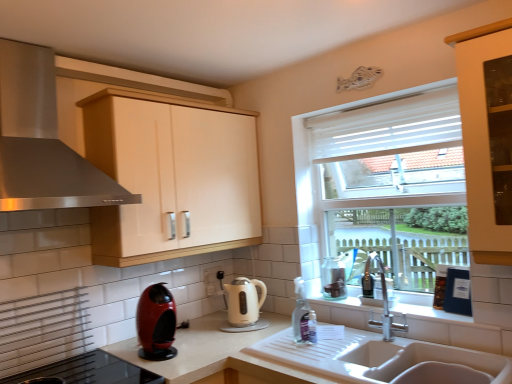
What do you see at coordinates (170, 176) in the screenshot? I see `matte cream cabinet at upper center` at bounding box center [170, 176].

Describe the element at coordinates (156, 323) in the screenshot. Image resolution: width=512 pixels, height=384 pixels. I see `shiny red coffee machine at lower left, which is counted as the second kitchen appliance, starting from the right` at that location.

The width and height of the screenshot is (512, 384). Describe the element at coordinates (385, 360) in the screenshot. I see `white ceramic sink at lower center` at that location.

Measure the distance between point (350, 334) and camera.

1.98 meters.

What do you see at coordinates (221, 356) in the screenshot? The height and width of the screenshot is (384, 512). I see `white matte countertop at sink` at bounding box center [221, 356].

The height and width of the screenshot is (384, 512). In order to click on matte cream cabinet at upper center in this screenshot , I will do `click(170, 176)`.

Is white matte countertop at sink positioned in front of clear glass jar at right?

Yes, white matte countertop at sink is in front of clear glass jar at right.

Considering the positions of objects white matte countertop at sink and clear glass jar at right in the image provided, who is more to the left, white matte countertop at sink or clear glass jar at right?

From the viewer's perspective, white matte countertop at sink appears more on the left side.

Which point is more forward, (123, 372) or (331, 261)?

The point (123, 372) is more forward.

Is white matte countertop at sink aimed at clear glass jar at right?

No, white matte countertop at sink is not facing towards clear glass jar at right.

Considering the sizes of matte cream cabinet at upper center and shiny red coffee machine at lower left, which ranks as the 2th kitchen appliance in back-to-front order, in the image, is matte cream cabinet at upper center taller or shorter than shiny red coffee machine at lower left, which ranks as the 2th kitchen appliance in back-to-front order,?

Clearly, matte cream cabinet at upper center is taller compared to shiny red coffee machine at lower left, which ranks as the 2th kitchen appliance in back-to-front order.

Is shiny red coffee machine at lower left, positioned as the 1th kitchen appliance in left-to-right order, a part of matte cream cabinet at upper center?

Actually, shiny red coffee machine at lower left, positioned as the 1th kitchen appliance in left-to-right order, is outside matte cream cabinet at upper center.

Which object is positioned more to the left, matte cream cabinet at upper center or shiny red coffee machine at lower left, which is counted as the second kitchen appliance, starting from the right?

Positioned to the left is shiny red coffee machine at lower left, which is counted as the second kitchen appliance, starting from the right.

Which is behind, point (196, 252) or point (146, 304)?

The point (196, 252) is more distant.

Does stainless steel range hood at upper left have a greater width compared to white matte countertop at sink?

Incorrect, the width of stainless steel range hood at upper left does not surpass that of white matte countertop at sink.

Does stainless steel range hood at upper left have a greater height compared to white matte countertop at sink?

Yes.

Find the location of a particular element. The height and width of the screenshot is (384, 512). home appliance to the left of white matte countertop at sink is located at coordinates (42, 141).

Which of these two, stainless steel range hood at upper left or white matte countertop at sink, is bigger?

white matte countertop at sink.

Considering the relative sizes of white matte countertop at sink and white ceramic sink at lower center in the image provided, is white matte countertop at sink smaller than white ceramic sink at lower center?

No, white matte countertop at sink is not smaller than white ceramic sink at lower center.

Based on the photo, is white matte countertop at sink surrounding white ceramic sink at lower center?

Indeed, white ceramic sink at lower center is located within white matte countertop at sink.

Is white matte countertop at sink closer to camera compared to white ceramic sink at lower center?

Yes, white matte countertop at sink is in front of white ceramic sink at lower center.

Who is bigger, shiny red coffee machine at lower left, arranged as the 1th kitchen appliance when viewed from the front, or white ceramic sink at lower center?

With larger size is white ceramic sink at lower center.

Is shiny red coffee machine at lower left, arranged as the 1th kitchen appliance when viewed from the front, wider or thinner than white ceramic sink at lower center?

shiny red coffee machine at lower left, arranged as the 1th kitchen appliance when viewed from the front, is thinner than white ceramic sink at lower center.

Is shiny red coffee machine at lower left, which is counted as the second kitchen appliance, starting from the right, completely or partially outside of white ceramic sink at lower center?

Yes, shiny red coffee machine at lower left, which is counted as the second kitchen appliance, starting from the right, is not within white ceramic sink at lower center.

From the image's perspective, between shiny red coffee machine at lower left, which is counted as the second kitchen appliance, starting from the right, and white ceramic sink at lower center, which one is located above?

shiny red coffee machine at lower left, which is counted as the second kitchen appliance, starting from the right, is shown above in the image.

From a real-world perspective, which object rests below the other?

In real-world perspective, white matte countertop at sink is lower.

Is matte cream cabinet at upper center located within white matte countertop at sink?

Definitely not — matte cream cabinet at upper center is not inside white matte countertop at sink.

Find the location of a particular element. countertop below the matte cream cabinet at upper center (from the image's perspective) is located at coordinates (221, 356).

Who is taller, white matte countertop at sink or matte cream cabinet at upper center?

Standing taller between the two is matte cream cabinet at upper center.

From a real-world perspective, is clear glass jar at right under stainless steel range hood at upper left?

Indeed, from a real-world perspective, clear glass jar at right is positioned beneath stainless steel range hood at upper left.

From the image's perspective, is clear glass jar at right located beneath stainless steel range hood at upper left?

Correct, clear glass jar at right appears lower than stainless steel range hood at upper left in the image.

Who is smaller, clear glass jar at right or stainless steel range hood at upper left?

clear glass jar at right is smaller.

Identify the location of countertop to the left of clear glass jar at right. (221, 356).

The width and height of the screenshot is (512, 384). I want to click on cabinetry behind the shiny red coffee machine at lower left, which is counted as the second kitchen appliance, starting from the right, so coord(170,176).

When comparing their distances from shiny red coffee machine at lower left, which ranks as the 2th kitchen appliance in back-to-front order, does white ceramic sink at lower center or white matte countertop at sink seem further?

The object further to shiny red coffee machine at lower left, which ranks as the 2th kitchen appliance in back-to-front order, is white ceramic sink at lower center.

Which object lies nearer to the anchor point shiny red coffee machine at lower left, which ranks as the 2th kitchen appliance in back-to-front order, clear glass jar at right or white glossy electric kettle at center, acting as the 1th kitchen appliance starting from the right?

white glossy electric kettle at center, acting as the 1th kitchen appliance starting from the right, lies closer to shiny red coffee machine at lower left, which ranks as the 2th kitchen appliance in back-to-front order, than the other object.

Estimate the real-world distances between objects in this image. Which object is closer to white ceramic sink at lower center, matte cream cabinet at upper center or stainless steel range hood at upper left?

matte cream cabinet at upper center is positioned closer to the anchor white ceramic sink at lower center.

Based on their spatial positions, is white glossy electric kettle at center, acting as the 1th kitchen appliance starting from the right, or stainless steel range hood at upper left closer to shiny red coffee machine at lower left, positioned as the 1th kitchen appliance in left-to-right order?

Based on the image, white glossy electric kettle at center, acting as the 1th kitchen appliance starting from the right, appears to be nearer to shiny red coffee machine at lower left, positioned as the 1th kitchen appliance in left-to-right order.

Based on their spatial positions, is white ceramic sink at lower center or white matte countertop at sink further from white glossy electric kettle at center, the first kitchen appliance in the back-to-front sequence?

white ceramic sink at lower center lies further to white glossy electric kettle at center, the first kitchen appliance in the back-to-front sequence, than the other object.

Considering their positions, is stainless steel range hood at upper left positioned closer to clear glass jar at right than matte cream cabinet at upper center?

matte cream cabinet at upper center lies closer to clear glass jar at right than the other object.

Considering their positions, is stainless steel range hood at upper left positioned closer to white glossy electric kettle at center, the first kitchen appliance in the back-to-front sequence, than white matte countertop at sink?

The object closer to white glossy electric kettle at center, the first kitchen appliance in the back-to-front sequence, is white matte countertop at sink.

Based on their spatial positions, is white glossy electric kettle at center, which is the second kitchen appliance from left to right, or stainless steel range hood at upper left closer to white ceramic sink at lower center?

white glossy electric kettle at center, which is the second kitchen appliance from left to right, is positioned closer to the anchor white ceramic sink at lower center.

In order to click on kitchen appliance between stainless steel range hood at upper left and white glossy electric kettle at center, which is the second kitchen appliance from left to right, from top to bottom in this screenshot , I will do `click(156, 323)`.

Where is `cabinetry between stainless steel range hood at upper left and clear glass jar at right`? cabinetry between stainless steel range hood at upper left and clear glass jar at right is located at coordinates (170, 176).

Locate an element on the screen. The width and height of the screenshot is (512, 384). cabinetry between stainless steel range hood at upper left and white matte countertop at sink from top to bottom is located at coordinates (170, 176).

This screenshot has width=512, height=384. I want to click on countertop between shiny red coffee machine at lower left, positioned as the 1th kitchen appliance in left-to-right order, and white ceramic sink at lower center, so click(x=221, y=356).